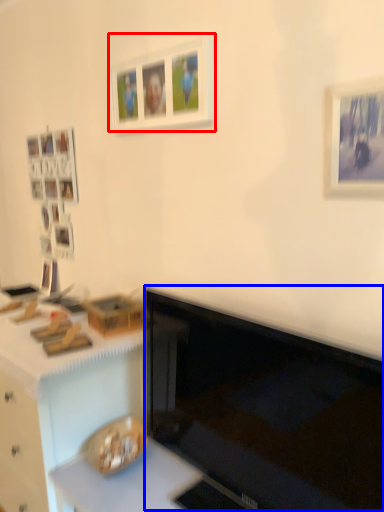
Question: Among these objects, which one is nearest to the camera, picture frame (highlighted by a red box) or computer monitor (highlighted by a blue box)?

Choices:
 (A) picture frame
 (B) computer monitor

Answer: (B)